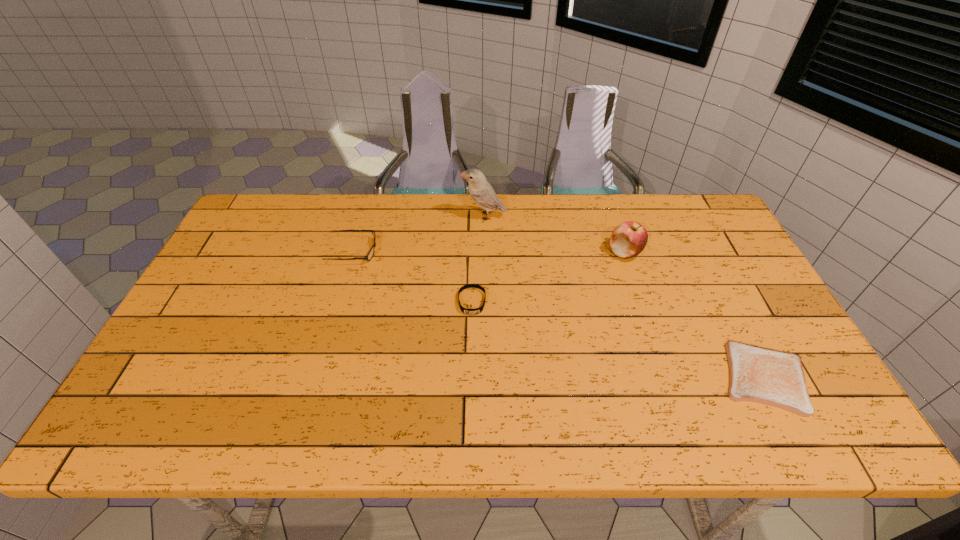
Locate an element on the screen. This screenshot has width=960, height=540. bird is located at coordinates (480, 190).

Where is `the farthest object`? the farthest object is located at coordinates (480, 190).

You are a GUI agent. You are given a task and a screenshot of the screen. Output one action in this format:
    pyautogui.click(x=<x>, y=<y>)
    Task: Click on the second object from right to left
    The width and height of the screenshot is (960, 540).
    Given the screenshot: What is the action you would take?
    pyautogui.click(x=628, y=239)

Identify the location of the second tallest object. (628, 239).

Locate an element on the screen. The width and height of the screenshot is (960, 540). the leftmost object is located at coordinates (371, 252).

Image resolution: width=960 pixels, height=540 pixels. I want to click on the third shortest object, so click(x=371, y=252).

Locate an element on the screen. the fourth tallest object is located at coordinates pos(478,310).

This screenshot has width=960, height=540. Identify the location of the fourth farthest object. (478, 310).

Locate an element on the screen. the rightmost object is located at coordinates (758, 374).

Locate an element on the screen. This screenshot has width=960, height=540. toast is located at coordinates (758, 374).